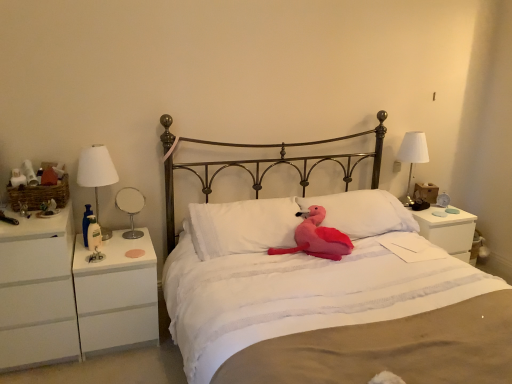
Question: Is white soft pillow at center, positioned as the second pillow in left-to-right order, in front of or behind pink plush toy at center in the image?

Choices:
 (A) front
 (B) behind

Answer: (B)

Question: From the image's perspective, is white soft pillow at center, positioned as the second pillow in left-to-right order, above or below pink plush toy at center?

Choices:
 (A) above
 (B) below

Answer: (A)

Question: Based on their relative distances, which object is farther from the white glossy table lamp at left?

Choices:
 (A) white soft pillow at center, the 1th pillow in the right-to-left sequence
 (B) white fabric lampshade at left, positioned as the 1th bedside lamp in left-to-right order
 (C) white fabric lampshade at right, arranged as the second bedside lamp when viewed from the front
 (D) pink plush toy at center
 (E) white plastic nightstand at left, the 2th nightstand in the left-to-right sequence

Answer: (C)

Question: Considering the real-world distances, which object is closest to the fluffy pink plush at center?

Choices:
 (A) white fabric lampshade at left, placed as the 2th bedside lamp when sorted from back to front
 (B) white fabric lampshade at right, which is the second bedside lamp in left-to-right order
 (C) white soft pillow at center, positioned as the second pillow in left-to-right order
 (D) white plastic nightstand at left, the 2th nightstand in the left-to-right sequence
 (E) white matte nightstand at right, acting as the 3th nightstand starting from the left

Answer: (C)